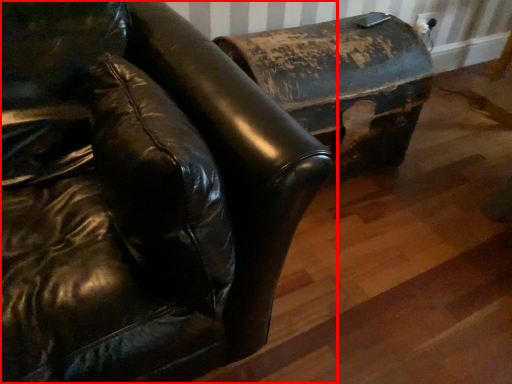
Question: From the image, what is the correct spatial relationship of furniture (annotated by the red box) in relation to furniture?

Choices:
 (A) left
 (B) right

Answer: (A)